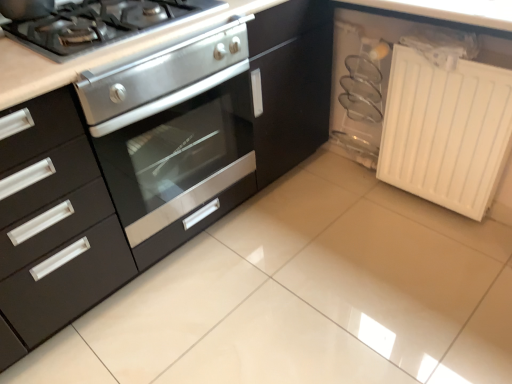
Image resolution: width=512 pixels, height=384 pixels. What are the coordinates of `free space above white matte radiator at lower right (from a real-world perspective)` in the screenshot? It's located at (442, 49).